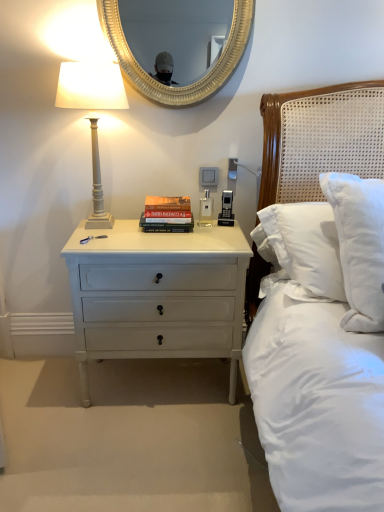
You are a GUI agent. You are given a task and a screenshot of the screen. Output one action in this format:
    pyautogui.click(x=<x>, y=<y>)
    Task: Click on the empty space that is ontop of white painted wood nightstand at lower left (from a real-world perspective)
    
    Given the screenshot: What is the action you would take?
    pyautogui.click(x=169, y=231)